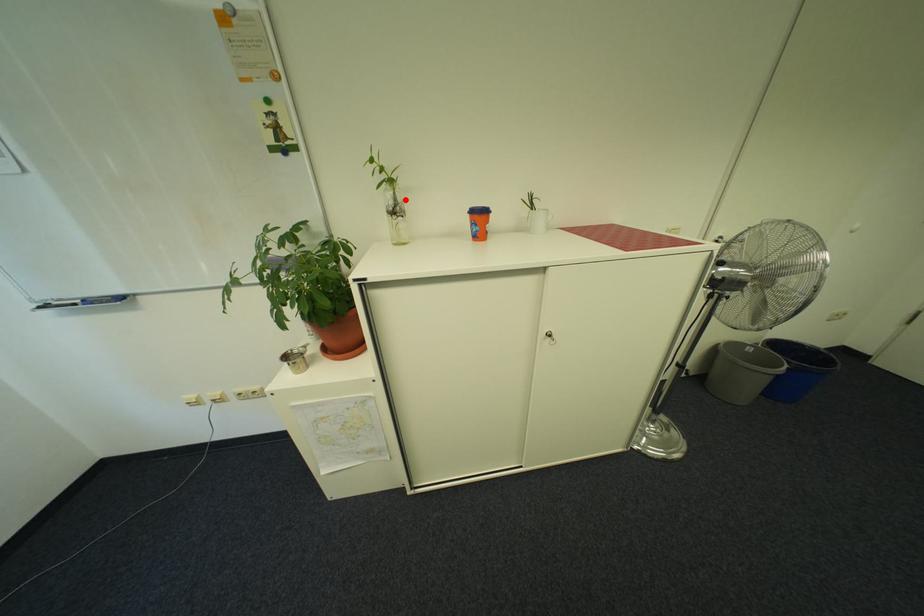
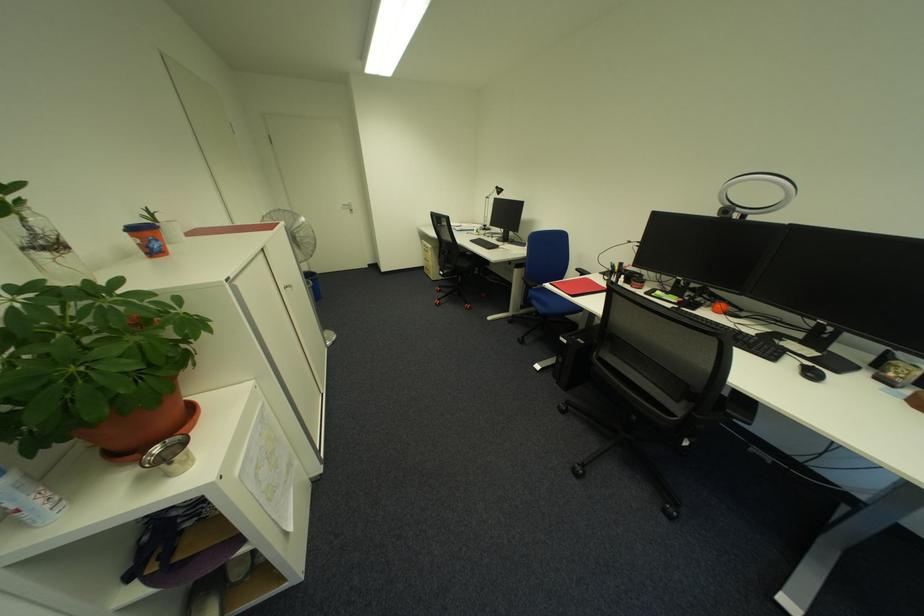
Where in the second image is the point corresponding to the highlighted location from the first image?

(40, 230)